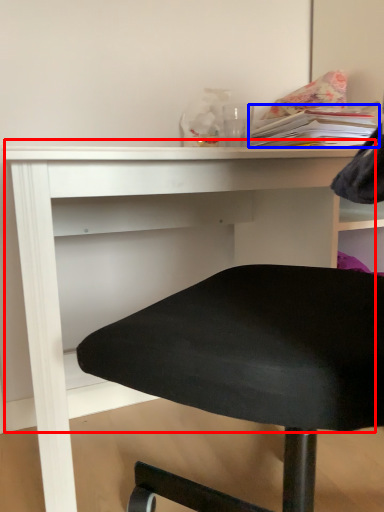
Question: Which point is closer to the camera, table (highlighted by a red box) or book (highlighted by a blue box)?

Choices:
 (A) table
 (B) book

Answer: (A)